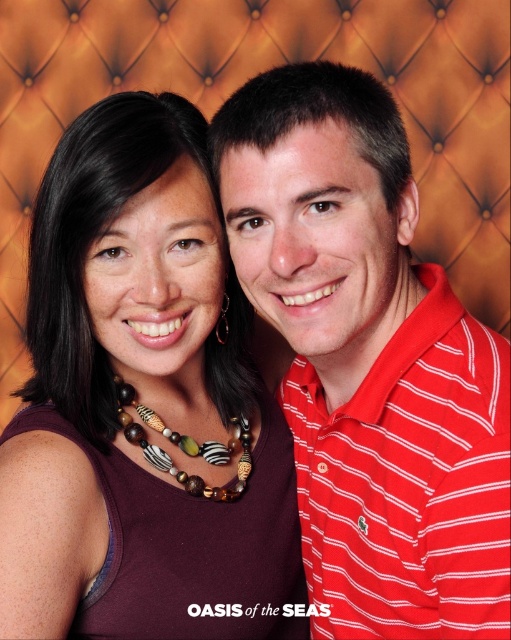
Which is below, matte brown necklace at center or wooden and zebra-patterned beads at center?

wooden and zebra-patterned beads at center is below.

You are a GUI agent. You are given a task and a screenshot of the screen. Output one action in this format:
    pyautogui.click(x=<x>, y=<y>)
    Task: Click on the matte brown necklace at center
    
    Given the screenshot: What is the action you would take?
    pyautogui.click(x=143, y=404)

Locate an element on the screen. Image resolution: width=511 pixels, height=640 pixels. matte brown necklace at center is located at coordinates (143, 404).

What do you see at coordinates (143, 404) in the screenshot?
I see `matte brown necklace at center` at bounding box center [143, 404].

Is point (123, 496) positioned before point (300, 125)?

That is False.

Which is behind, point (73, 515) or point (263, 152)?

The point (73, 515) is behind.

Identify the location of matte brown necklace at center. (143, 404).

Is red striped polo shirt at right positioned at the back of wooden and zebra-patterned beads at center?

No, red striped polo shirt at right is in front of wooden and zebra-patterned beads at center.

The height and width of the screenshot is (640, 511). Find the location of `red striped polo shirt at right`. red striped polo shirt at right is located at coordinates (368, 362).